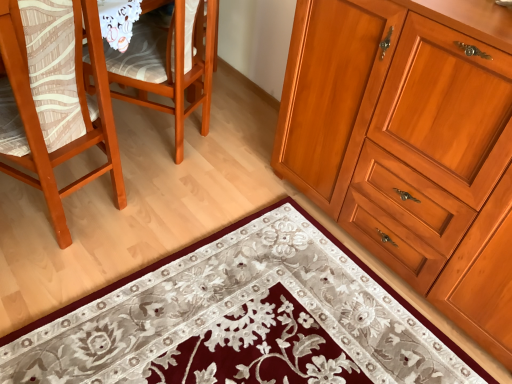
Question: Can you confirm if wooden chair at left, the 1th chair viewed from the right, is thinner than matte wood chair at left, arranged as the 1th chair when viewed from the left?

Choices:
 (A) no
 (B) yes

Answer: (A)

Question: Does wooden chair at left, the 1th chair viewed from the right, contain matte wood chair at left, arranged as the 1th chair when viewed from the left?

Choices:
 (A) no
 (B) yes

Answer: (A)

Question: Does wooden chair at left, the 1th chair viewed from the right, have a greater width compared to matte wood chair at left, the second chair when ordered from right to left?

Choices:
 (A) yes
 (B) no

Answer: (A)

Question: Can you confirm if wooden chair at left, the 1th chair viewed from the right, is positioned to the left of matte wood chair at left, arranged as the 1th chair when viewed from the left?

Choices:
 (A) yes
 (B) no

Answer: (B)

Question: Considering the relative sizes of wooden chair at left, placed as the 2th chair when sorted from left to right, and matte wood chair at left, arranged as the 1th chair when viewed from the left, in the image provided, is wooden chair at left, placed as the 2th chair when sorted from left to right, taller than matte wood chair at left, arranged as the 1th chair when viewed from the left,?

Choices:
 (A) yes
 (B) no

Answer: (B)

Question: In the image, is wooden chair at left, placed as the 2th chair when sorted from left to right, on the left side or the right side of matte wood chair at left, arranged as the 1th chair when viewed from the left?

Choices:
 (A) right
 (B) left

Answer: (A)

Question: Relative to matte wood chair at left, the second chair when ordered from right to left, is wooden chair at left, the 1th chair viewed from the right, in front or behind?

Choices:
 (A) behind
 (B) front

Answer: (A)

Question: Does point [x=139, y=104] appear closer or farther from the camera than point [x=33, y=92]?

Choices:
 (A) farther
 (B) closer

Answer: (A)

Question: Would you say wooden chair at left, placed as the 2th chair when sorted from left to right, is inside or outside matte wood chair at left, the second chair when ordered from right to left?

Choices:
 (A) inside
 (B) outside

Answer: (B)

Question: From the image's perspective, is matte wood chair at left, arranged as the 1th chair when viewed from the left, located above or below wooden chair at left, placed as the 2th chair when sorted from left to right?

Choices:
 (A) below
 (B) above

Answer: (A)

Question: From a real-world perspective, is matte wood chair at left, the second chair when ordered from right to left, physically located above or below wooden chair at left, the 1th chair viewed from the right?

Choices:
 (A) below
 (B) above

Answer: (B)

Question: In the image, is matte wood chair at left, arranged as the 1th chair when viewed from the left, on the left side or the right side of wooden chair at left, placed as the 2th chair when sorted from left to right?

Choices:
 (A) right
 (B) left

Answer: (B)

Question: In terms of size, does matte wood chair at left, arranged as the 1th chair when viewed from the left, appear bigger or smaller than wooden chair at left, the 1th chair viewed from the right?

Choices:
 (A) big
 (B) small

Answer: (A)

Question: Is wooden cabinet at right in front of or behind matte wood chair at left, the second chair when ordered from right to left, in the image?

Choices:
 (A) front
 (B) behind

Answer: (A)

Question: Visually, is wooden cabinet at right positioned to the left or to the right of matte wood chair at left, arranged as the 1th chair when viewed from the left?

Choices:
 (A) right
 (B) left

Answer: (A)